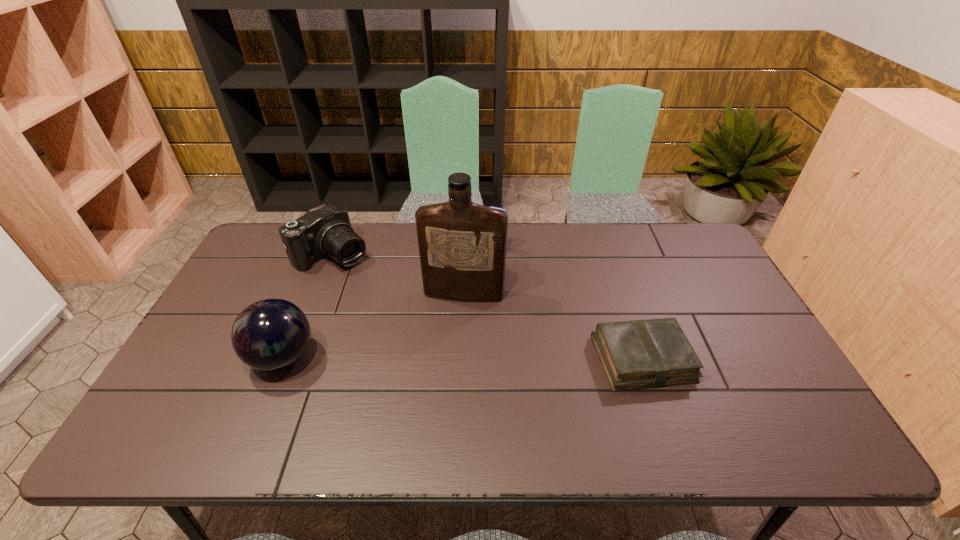
Locate an element on the screen. free space between the camera and the shortest object is located at coordinates (488, 307).

I want to click on free area in between the bowling ball and the shortest object, so click(463, 358).

You are a GUI agent. You are given a task and a screenshot of the screen. Output one action in this format:
    pyautogui.click(x=<x>, y=<y>)
    Task: Click on the vacant area that lies between the cellular telephone and the bowling ball
    
    Given the screenshot: What is the action you would take?
    pyautogui.click(x=389, y=304)

Identify which object is the second closest to the bowling ball. Please provide its 2D coordinates. Your answer should be formatted as a tuple, i.e. [(x, y)], where the tuple contains the x and y coordinates of a point satisfying the conditions above.

[(462, 245)]

Choose which object is the fourth nearest neighbor to the camera. Please provide its 2D coordinates. Your answer should be formatted as a tuple, i.e. [(x, y)], where the tuple contains the x and y coordinates of a point satisfying the conditions above.

[(638, 354)]

Where is `vacant area that satisfies the following two spatial constraints: 1. on the front side of the book; 2. on the left side of the cellular telephone`? vacant area that satisfies the following two spatial constraints: 1. on the front side of the book; 2. on the left side of the cellular telephone is located at coordinates (500, 359).

The image size is (960, 540). Identify the location of vacant point that satisfies the following two spatial constraints: 1. on the front side of the cellular telephone; 2. on the right side of the shortest object. [x=500, y=359].